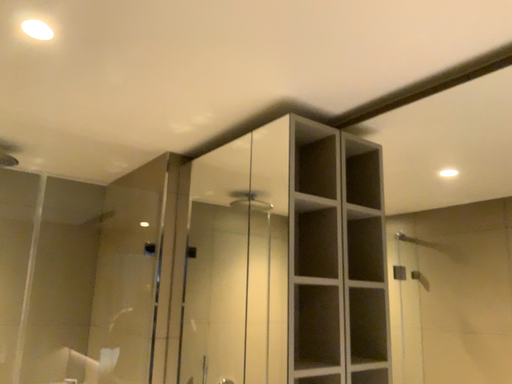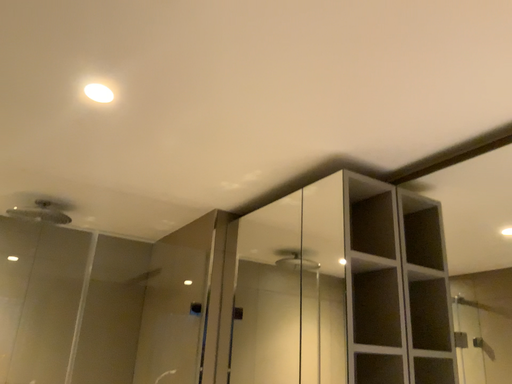
Question: How did the camera likely rotate when shooting the video?

Choices:
 (A) rotated downward
 (B) rotated upward

Answer: (B)